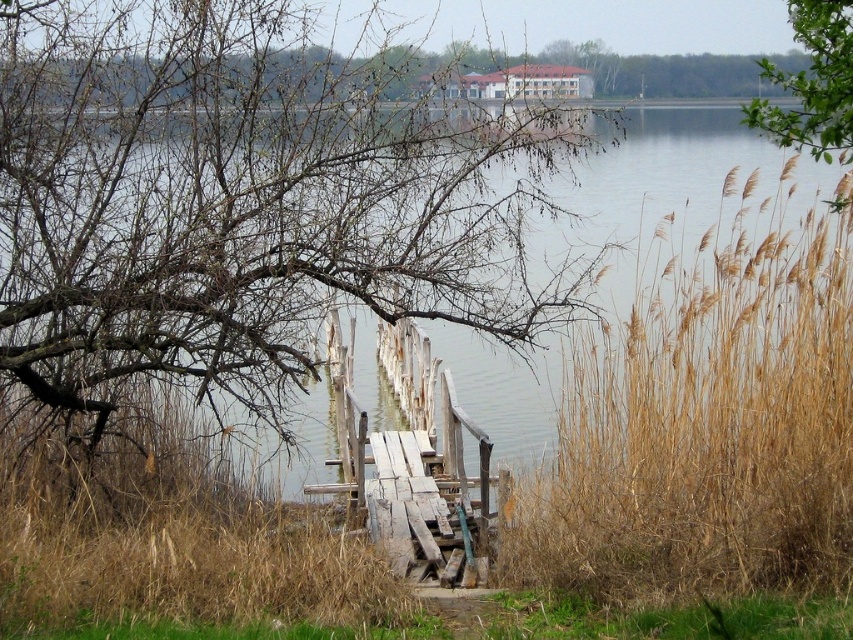
Question: Which point appears farthest from the camera in this image?

Choices:
 (A) (795, 616)
 (B) (804, 45)

Answer: (B)

Question: Which point appears farthest from the camera in this image?

Choices:
 (A) click(x=683, y=317)
 (B) click(x=642, y=83)
 (C) click(x=746, y=120)
 (D) click(x=585, y=632)

Answer: (B)

Question: Which point is closer to the camera?

Choices:
 (A) dry grass at right
 (B) dry grass at lower center

Answer: (B)

Question: Considering the relative positions of dry grass at lower center and bare branches at upper center in the image provided, where is dry grass at lower center located with respect to bare branches at upper center?

Choices:
 (A) left
 (B) right

Answer: (A)

Question: Does green leafy branch at upper right have a lesser width compared to bare branches at upper center?

Choices:
 (A) no
 (B) yes

Answer: (B)

Question: Does dry grass at right appear over bare branches at upper center?

Choices:
 (A) no
 (B) yes

Answer: (A)